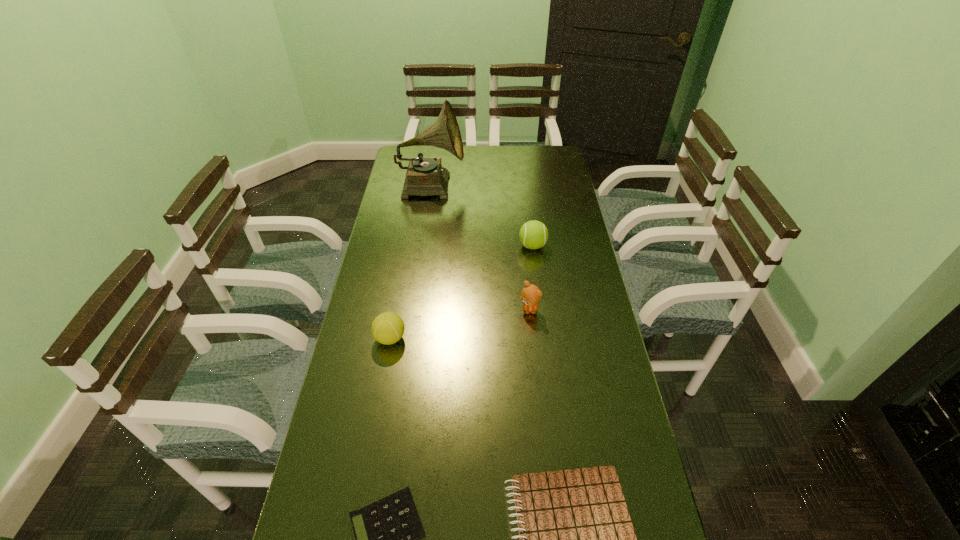
Image resolution: width=960 pixels, height=540 pixels. In order to click on free spot located on the right of the nearer tennis ball in this screenshot , I will do `click(533, 338)`.

You are a GUI agent. You are given a task and a screenshot of the screen. Output one action in this format:
    pyautogui.click(x=<x>, y=<y>)
    Task: Click on the object that is at the far edge
    The height and width of the screenshot is (540, 960).
    Given the screenshot: What is the action you would take?
    pyautogui.click(x=425, y=176)

At what (x,y) coordinates should I click in order to perform the action: click on record player that is positioned at the left edge. Please return your answer as a coordinate pair (x, y). Image resolution: width=960 pixels, height=540 pixels. Looking at the image, I should click on (425, 176).

Where is `tennis ball that is at the left edge`? This screenshot has height=540, width=960. tennis ball that is at the left edge is located at coordinates (387, 328).

This screenshot has height=540, width=960. Identify the location of object located in the right edge section of the desktop. (533, 234).

Find the location of a particular element. This screenshot has width=960, height=540. object that is at the far left corner is located at coordinates (425, 176).

Locate an element on the screen. The width and height of the screenshot is (960, 540). blank area at the far edge is located at coordinates (512, 153).

Locate an element on the screen. free location at the left edge is located at coordinates [393, 284].

Find the location of `free space at the right edge of the desktop`. free space at the right edge of the desktop is located at coordinates (537, 177).

Image resolution: width=960 pixels, height=540 pixels. In the image, there is a desktop. Find the location of `vacant space at the far left corner`. vacant space at the far left corner is located at coordinates (401, 171).